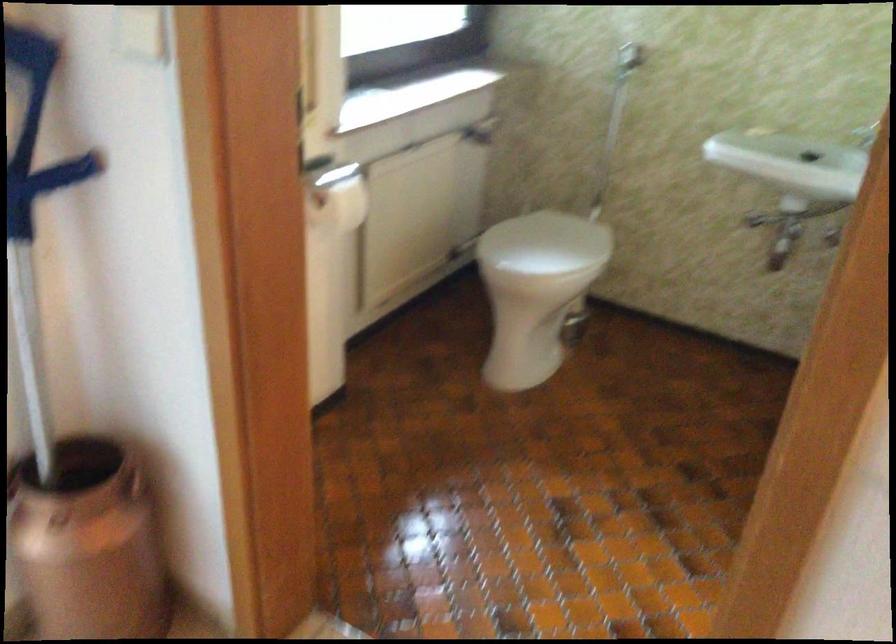
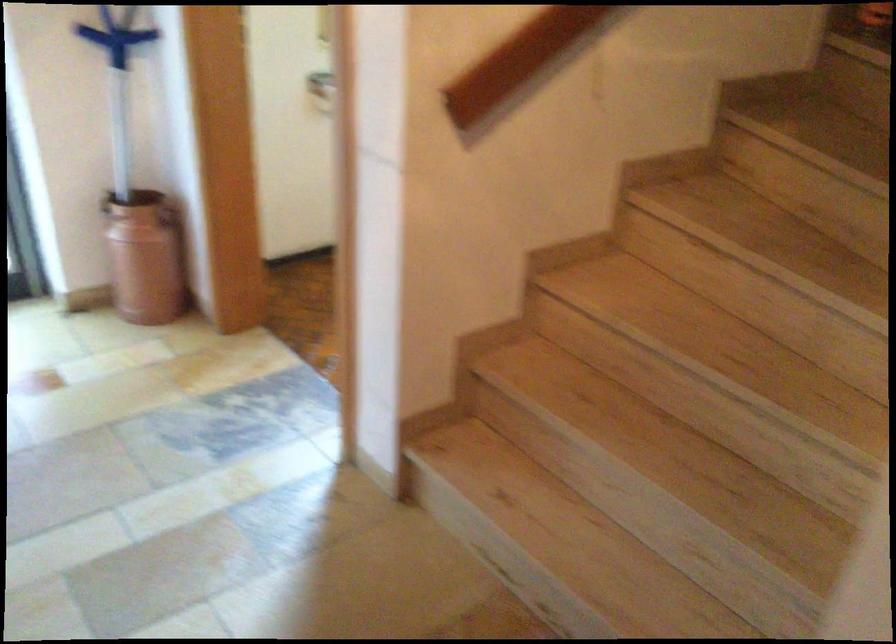
The point at (142, 480) is marked in the first image. Where is the corresponding point in the second image?

(168, 216)